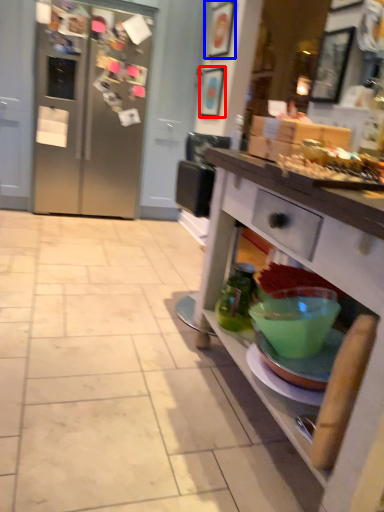
Question: Which point is closer to the camera, picture frame (highlighted by a red box) or picture frame (highlighted by a blue box)?

Choices:
 (A) picture frame
 (B) picture frame

Answer: (B)